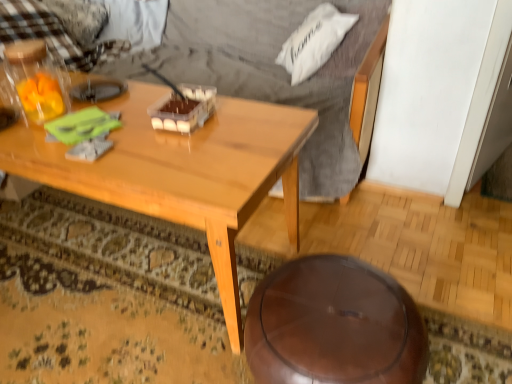
Where is `white soft pillow at upper right, which is counted as the first pillow, starting from the front`? The height and width of the screenshot is (384, 512). white soft pillow at upper right, which is counted as the first pillow, starting from the front is located at coordinates (314, 41).

Identify the location of checkered fabric pillow at upper left, placed as the 2th pillow when sorted from front to back. The width and height of the screenshot is (512, 384). (80, 19).

Find the location of a particular element. This screenshot has height=384, width=512. shiny brown stool at lower center is located at coordinates (334, 325).

Where is `translucent plastic bottle at upper left`? translucent plastic bottle at upper left is located at coordinates (34, 82).

This screenshot has height=384, width=512. Describe the element at coordinates (183, 172) in the screenshot. I see `light brown wood coffee table at center` at that location.

Locate an element on the screen. This screenshot has height=384, width=512. white soft pillow at upper right, positioned as the 2th pillow in back-to-front order is located at coordinates click(314, 41).

Does point (61, 98) lie behind point (170, 95)?

No.

Consider the image. From the image's perspective, which is above, translucent plastic bottle at upper left or translucent plastic container at center?

From the image's view, translucent plastic bottle at upper left is above.

From a real-world perspective, is translucent plastic bottle at upper left above or below translucent plastic container at center?

translucent plastic bottle at upper left is situated higher than translucent plastic container at center in the real world.

Where is `bottle lying in front of the translucent plastic container at center`? bottle lying in front of the translucent plastic container at center is located at coordinates (34, 82).

Is checkered fabric pillow at upper left, the 1th pillow when ordered from back to front, oriented away from shiny brown stool at lower center?

No.

Is checkered fabric pillow at upper left, which is the second pillow from right to left, positioned in front of shiny brown stool at lower center?

No, it is not.

Does point (86, 23) appear closer or farther from the camera than point (325, 285)?

Clearly, point (86, 23) is more distant from the camera than point (325, 285).

From the picture: Does translucent plastic container at center lie in front of light brown wood coffee table at center?

No, the depth of translucent plastic container at center is greater than that of light brown wood coffee table at center.

Is translucent plastic container at center oriented away from light brown wood coffee table at center?

No, translucent plastic container at center is not facing away from light brown wood coffee table at center.

Is translucent plastic container at center beside light brown wood coffee table at center?

No.

Considering the points (198, 126) and (296, 248), which point is behind, point (198, 126) or point (296, 248)?

The point (296, 248) is more distant.

In the image, there is a white soft pillow at upper right, the second pillow in the left-to-right sequence. Identify the location of coffee table below it (from a real-world perspective). The width and height of the screenshot is (512, 384). (183, 172).

Can white soft pillow at upper right, the first pillow in the right-to-left sequence, be found inside light brown wood coffee table at center?

Definitely not — white soft pillow at upper right, the first pillow in the right-to-left sequence, is not inside light brown wood coffee table at center.

Which is behind, light brown wood coffee table at center or white soft pillow at upper right, positioned as the 2th pillow in back-to-front order?

white soft pillow at upper right, positioned as the 2th pillow in back-to-front order.

Choose the correct answer: Is translucent plastic container at center inside shiny brown stool at lower center or outside it?

translucent plastic container at center is not enclosed by shiny brown stool at lower center.

From the image's perspective, is translucent plastic container at center under shiny brown stool at lower center?

No, from the image's perspective, translucent plastic container at center is not beneath shiny brown stool at lower center.

Which object is more forward, translucent plastic container at center or shiny brown stool at lower center?

Positioned in front is shiny brown stool at lower center.

Can you tell me how much translucent plastic container at center and shiny brown stool at lower center differ in facing direction?

They differ by 1.59 degrees in their facing directions.

How different are the orientations of checkered fabric pillow at upper left, the 1th pillow when ordered from back to front, and white soft pillow at upper right, which is counted as the first pillow, starting from the front, in degrees?

They differ by 50 degrees in their facing directions.

Which object is further away from the camera, checkered fabric pillow at upper left, placed as the 2th pillow when sorted from front to back, or white soft pillow at upper right, the first pillow in the right-to-left sequence?

checkered fabric pillow at upper left, placed as the 2th pillow when sorted from front to back, is behind.

Are checkered fabric pillow at upper left, placed as the 2th pillow when sorted from front to back, and white soft pillow at upper right, positioned as the 2th pillow in back-to-front order, beside each other?

There is a gap between checkered fabric pillow at upper left, placed as the 2th pillow when sorted from front to back, and white soft pillow at upper right, positioned as the 2th pillow in back-to-front order.

From the image's perspective, is checkered fabric pillow at upper left, acting as the first pillow starting from the left, located above or below white soft pillow at upper right, the second pillow in the left-to-right sequence?

Clearly, from the image's perspective, checkered fabric pillow at upper left, acting as the first pillow starting from the left, is above white soft pillow at upper right, the second pillow in the left-to-right sequence.

Considering the sizes of objects translucent plastic container at center and translucent plastic bottle at upper left in the image provided, who is wider, translucent plastic container at center or translucent plastic bottle at upper left?

With larger width is translucent plastic container at center.

Can you confirm if translucent plastic container at center is shorter than translucent plastic bottle at upper left?

Yes.

This screenshot has height=384, width=512. Find the location of `food behind the translucent plastic bottle at upper left`. food behind the translucent plastic bottle at upper left is located at coordinates (184, 109).

Considering the positions of objects translucent plastic container at center and translucent plastic bottle at upper left in the image provided, who is more to the left, translucent plastic container at center or translucent plastic bottle at upper left?

Positioned to the left is translucent plastic bottle at upper left.

This screenshot has height=384, width=512. Find the location of `bottle above the translucent plastic container at center (from the image's perspective)`. bottle above the translucent plastic container at center (from the image's perspective) is located at coordinates (34, 82).

Identify the location of the 2nd pillow behind when counting from the shiny brown stool at lower center. (80, 19).

From the image, which object appears to be farther from light brown wood coffee table at center, translucent plastic container at center or checkered fabric pillow at upper left, the 1th pillow when ordered from back to front?

checkered fabric pillow at upper left, the 1th pillow when ordered from back to front, lies further to light brown wood coffee table at center than the other object.

Looking at the image, which one is located closer to translucent plastic bottle at upper left, checkered fabric pillow at upper left, the 1th pillow when ordered from back to front, or light brown wood coffee table at center?

Among the two, light brown wood coffee table at center is located nearer to translucent plastic bottle at upper left.

Considering their positions, is checkered fabric pillow at upper left, which is the second pillow from right to left, positioned further to translucent plastic bottle at upper left than white soft pillow at upper right, positioned as the 2th pillow in back-to-front order?

Among the two, white soft pillow at upper right, positioned as the 2th pillow in back-to-front order, is located further to translucent plastic bottle at upper left.

Which object lies further to the anchor point checkered fabric pillow at upper left, placed as the 2th pillow when sorted from front to back, translucent plastic bottle at upper left or translucent plastic container at center?

translucent plastic container at center lies further to checkered fabric pillow at upper left, placed as the 2th pillow when sorted from front to back, than the other object.

Based on their spatial positions, is light brown wood coffee table at center or translucent plastic container at center further from translucent plastic bottle at upper left?

translucent plastic container at center lies further to translucent plastic bottle at upper left than the other object.

Estimate the real-world distances between objects in this image. Which object is further from shiny brown stool at lower center, checkered fabric pillow at upper left, which is the second pillow from right to left, or translucent plastic container at center?

checkered fabric pillow at upper left, which is the second pillow from right to left.

Estimate the real-world distances between objects in this image. Which object is further from white soft pillow at upper right, the second pillow in the left-to-right sequence, translucent plastic bottle at upper left or translucent plastic container at center?

translucent plastic bottle at upper left lies further to white soft pillow at upper right, the second pillow in the left-to-right sequence, than the other object.

Consider the image. Considering their positions, is light brown wood coffee table at center positioned closer to checkered fabric pillow at upper left, acting as the first pillow starting from the left, than translucent plastic container at center?

The object closer to checkered fabric pillow at upper left, acting as the first pillow starting from the left, is light brown wood coffee table at center.

Locate an element on the screen. Image resolution: width=512 pixels, height=384 pixels. food situated between light brown wood coffee table at center and shiny brown stool at lower center from left to right is located at coordinates (184, 109).

You are a GUI agent. You are given a task and a screenshot of the screen. Output one action in this format:
    pyautogui.click(x=<x>, y=<y>)
    Task: Click on the coffee table positioned between shiny brown stool at lower center and checkered fabric pillow at upper left, acting as the first pillow starting from the left, from near to far
    
    Given the screenshot: What is the action you would take?
    pyautogui.click(x=183, y=172)

Where is `coffee table situated between translucent plastic bottle at upper left and translucent plastic container at center from left to right`? coffee table situated between translucent plastic bottle at upper left and translucent plastic container at center from left to right is located at coordinates (183, 172).

Where is `bottle between light brown wood coffee table at center and checkered fabric pillow at upper left, the 1th pillow when ordered from back to front, from front to back`? The height and width of the screenshot is (384, 512). bottle between light brown wood coffee table at center and checkered fabric pillow at upper left, the 1th pillow when ordered from back to front, from front to back is located at coordinates (34, 82).